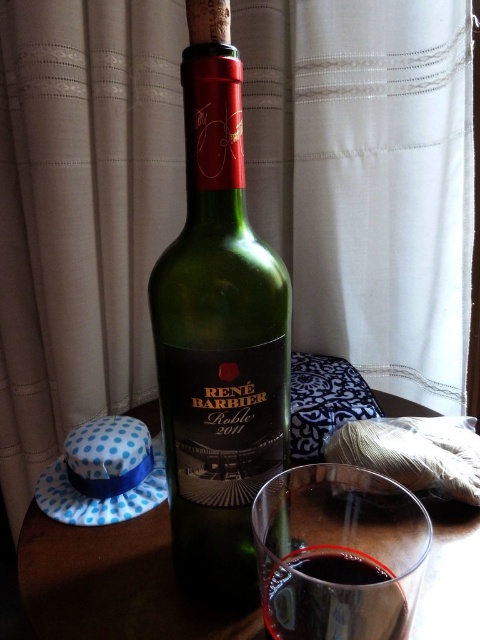
Question: Which point appears closest to the camera in this image?

Choices:
 (A) (196, 186)
 (B) (37, 627)

Answer: (A)

Question: Which of the following is the closest to the observer?

Choices:
 (A) brown wooden table at center
 (B) dark red liquid at center
 (C) green glass bottle at center

Answer: (B)

Question: Is green glass bottle at center in front of dark red liquid at center?

Choices:
 (A) yes
 (B) no

Answer: (B)

Question: Which of these objects is positioned closest to the transparent glass at center?

Choices:
 (A) green glass bottle at center
 (B) dark red liquid at center

Answer: (B)

Question: Is the position of brown wooden table at center more distant than that of transparent glass at center?

Choices:
 (A) yes
 (B) no

Answer: (A)

Question: Does green glass bottle at center appear on the left side of dark red liquid at center?

Choices:
 (A) no
 (B) yes

Answer: (B)